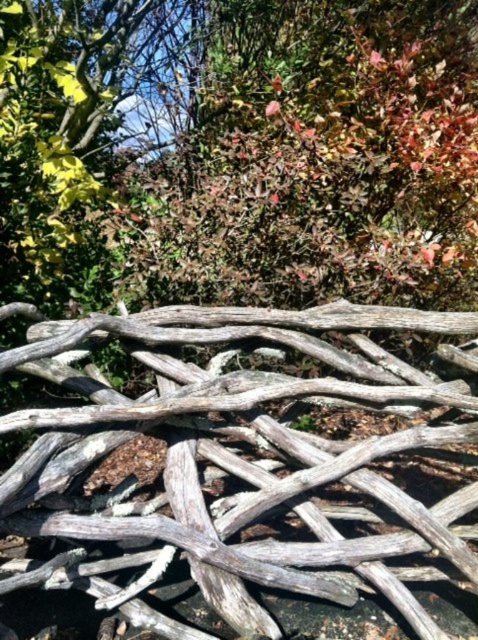
Is weathered wood at bottom above green matte leaves at upper center?

Actually, weathered wood at bottom is below green matte leaves at upper center.

Who is positioned more to the right, weathered wood at bottom or green matte leaves at upper center?

From the viewer's perspective, green matte leaves at upper center appears more on the right side.

I want to click on weathered wood at bottom, so click(238, 465).

You are a GUI agent. You are given a task and a screenshot of the screen. Output one action in this format:
    pyautogui.click(x=<x>, y=<y>)
    Task: Click on the weathered wood at bottom
    The height and width of the screenshot is (640, 478).
    Given the screenshot: What is the action you would take?
    pyautogui.click(x=238, y=465)